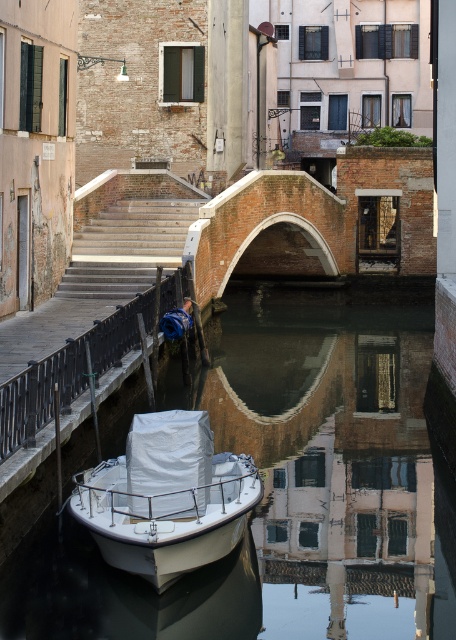
Does white matte boat at lower center appear on the right side of smooth metal railing at lower left?

Correct, you'll find white matte boat at lower center to the right of smooth metal railing at lower left.

Between point (134, 419) and point (37, 380), which one is positioned in front?

Point (134, 419) is more forward.

Which is behind, point (228, 472) or point (9, 403)?

Point (228, 472)

Where is `white matte boat at lower center`? The width and height of the screenshot is (456, 640). white matte boat at lower center is located at coordinates (166, 497).

Is point (61, 592) positioned before point (141, 449)?

No.

Who is positioned more to the right, white plastic boat at lower center or white matte boat at lower center?

white plastic boat at lower center

Who is more forward, (x=336, y=614) or (x=239, y=522)?

Positioned in front is point (x=336, y=614).

The width and height of the screenshot is (456, 640). Find the location of `white plastic boat at lower center`. white plastic boat at lower center is located at coordinates (285, 484).

Does white plastic boat at lower center have a lesser width compared to smooth metal railing at lower left?

Answer: Incorrect, white plastic boat at lower center's width is not less than smooth metal railing at lower left's.

Between white plastic boat at lower center and smooth metal railing at lower left, which one is positioned lower?

white plastic boat at lower center

Between point (300, 566) and point (52, 384), which one is positioned in front?

Point (52, 384) is more forward.

You are a GUI agent. You are given a task and a screenshot of the screen. Output one action in this format:
    pyautogui.click(x=<x>, y=<y>)
    Task: Click on the white plastic boat at lower center
    Image resolution: width=456 pixels, height=640 pixels.
    Given the screenshot: What is the action you would take?
    tap(285, 484)